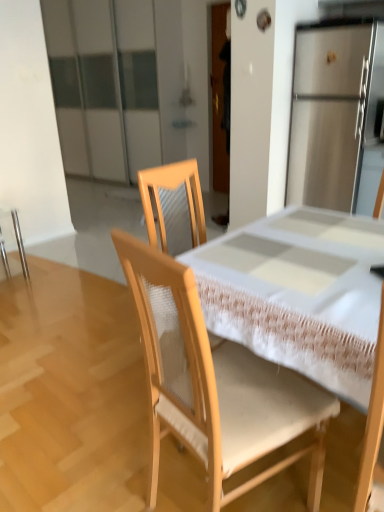
Image resolution: width=384 pixels, height=512 pixels. Identify the location of free space to the right of metallic silver chair at left, which is the 2th chair in right-to-left order. (49, 268).